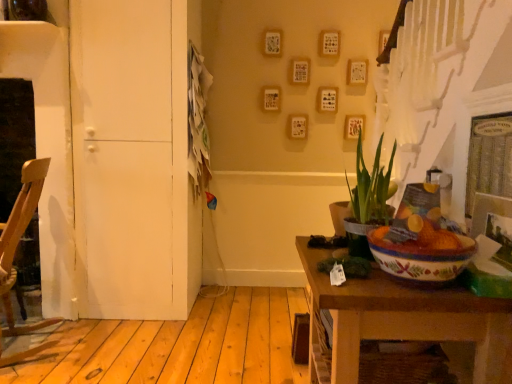
Question: From a real-world perspective, is white matte door at left positioned above or below green leafy plant at center?

Choices:
 (A) below
 (B) above

Answer: (B)

Question: From the image's perspective, is white matte door at left positioned above or below green leafy plant at center?

Choices:
 (A) above
 (B) below

Answer: (A)

Question: Estimate the real-world distances between objects in this image. Which object is farther from the white matte door at left?

Choices:
 (A) wooden table at lower right
 (B) green leafy plant at center
 (C) wooden chair at left

Answer: (A)

Question: Which object is the farthest from the wooden table at lower right?

Choices:
 (A) wooden chair at left
 (B) white matte door at left
 (C) green leafy plant at center

Answer: (A)